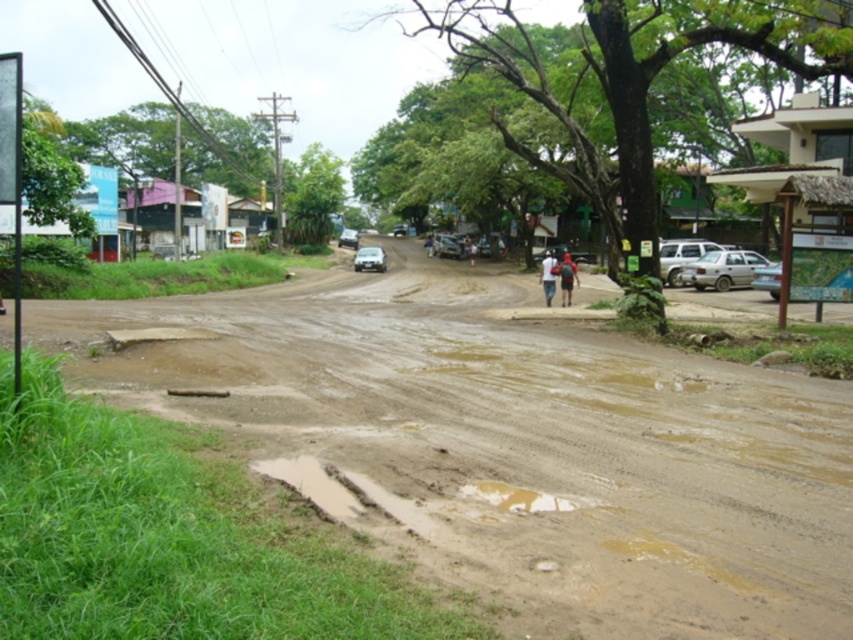
Question: Which object appears closest to the camera in this image?

Choices:
 (A) red fabric backpack at center
 (B) brown muddy road at center
 (C) white matte shirt at center

Answer: (B)

Question: Can you confirm if brown muddy road at center is positioned above red fabric backpack at center?

Choices:
 (A) no
 (B) yes

Answer: (A)

Question: Is red fabric backpack at center wider than white matte shirt at center?

Choices:
 (A) no
 (B) yes

Answer: (B)

Question: Where is brown muddy road at center located in relation to white matte shirt at center in the image?

Choices:
 (A) below
 (B) above

Answer: (A)

Question: Which point is closer to the camera?

Choices:
 (A) (264, 444)
 (B) (560, 289)
 (C) (549, 280)

Answer: (A)

Question: Estimate the real-world distances between objects in this image. Which object is farther from the red fabric backpack at center?

Choices:
 (A) brown muddy road at center
 (B) white matte shirt at center

Answer: (A)